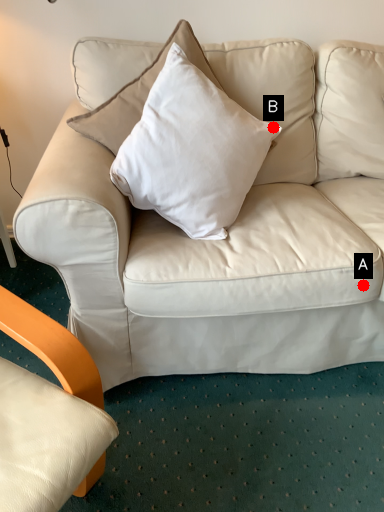
Question: Two points are circled on the image, labeled by A and B beside each circle. Among these points, which one is nearest to the camera?

Choices:
 (A) A is closer
 (B) B is closer

Answer: (A)